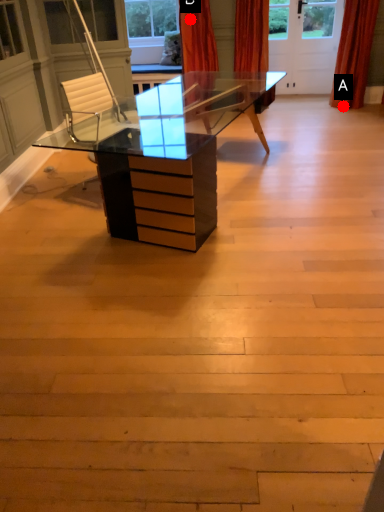
Question: Two points are circled on the image, labeled by A and B beside each circle. Which point is farther to the camera?

Choices:
 (A) A is further
 (B) B is further

Answer: (A)